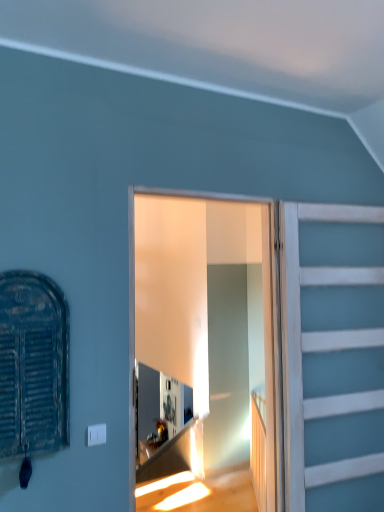
Question: Would you say clear glass door at center contains white painted wood at right?

Choices:
 (A) yes
 (B) no

Answer: (B)

Question: Can you confirm if clear glass door at center is positioned to the left of white painted wood at right?

Choices:
 (A) no
 (B) yes

Answer: (B)

Question: Is clear glass door at center bigger than white painted wood at right?

Choices:
 (A) yes
 (B) no

Answer: (B)

Question: Is clear glass door at center facing away from white painted wood at right?

Choices:
 (A) no
 (B) yes

Answer: (A)

Question: Considering the relative sizes of clear glass door at center and white painted wood at right in the image provided, is clear glass door at center smaller than white painted wood at right?

Choices:
 (A) yes
 (B) no

Answer: (A)

Question: Is rusty metal shutter at left wider or thinner than clear glass door at center?

Choices:
 (A) wide
 (B) thin

Answer: (B)

Question: Does point (41, 416) appear closer or farther from the camera than point (170, 272)?

Choices:
 (A) farther
 (B) closer

Answer: (B)

Question: In terms of height, does rusty metal shutter at left look taller or shorter compared to clear glass door at center?

Choices:
 (A) tall
 (B) short

Answer: (B)

Question: Do you think rusty metal shutter at left is within clear glass door at center, or outside of it?

Choices:
 (A) inside
 (B) outside

Answer: (B)

Question: From a real-world perspective, is clear glass door at center physically located above or below white painted wood at right?

Choices:
 (A) below
 (B) above

Answer: (B)

Question: In the image, is clear glass door at center on the left side or the right side of white painted wood at right?

Choices:
 (A) left
 (B) right

Answer: (A)

Question: Considering the positions of clear glass door at center and white painted wood at right in the image, is clear glass door at center wider or thinner than white painted wood at right?

Choices:
 (A) wide
 (B) thin

Answer: (B)

Question: Is point (177, 345) positioned closer to the camera than point (309, 489)?

Choices:
 (A) farther
 (B) closer

Answer: (A)

Question: Considering the positions of clear glass door at center and rusty metal shutter at left in the image, is clear glass door at center wider or thinner than rusty metal shutter at left?

Choices:
 (A) thin
 (B) wide

Answer: (B)

Question: From the image's perspective, is clear glass door at center located above or below rusty metal shutter at left?

Choices:
 (A) below
 (B) above

Answer: (A)